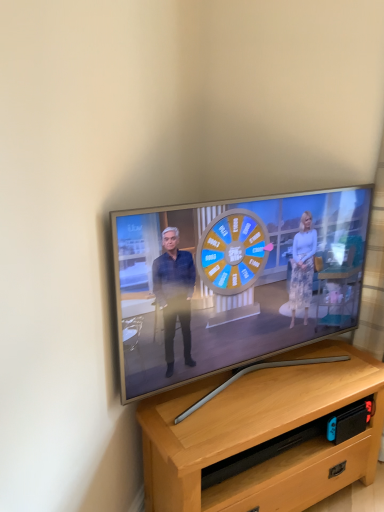
Find the location of `light brown wood desk at center`. light brown wood desk at center is located at coordinates click(261, 435).

Image resolution: width=384 pixels, height=512 pixels. What do you see at coordinates (261, 435) in the screenshot?
I see `light brown wood desk at center` at bounding box center [261, 435].

What do you see at coordinates (234, 282) in the screenshot?
I see `matte silver tv at center` at bounding box center [234, 282].

Find the location of a particular element. This screenshot has width=384, height=512. matte silver tv at center is located at coordinates (234, 282).

At what (x,y) coordinates should I click in order to perform the action: click on light brown wood desk at center. Please return your answer as a coordinate pair (x, y). Looking at the image, I should click on (261, 435).

Which object is positioned more to the left, matte silver tv at center or light brown wood desk at center?

matte silver tv at center is more to the left.

Is matte silver tv at center further to the viewer compared to light brown wood desk at center?

No, matte silver tv at center is closer to the camera.

Is point (323, 250) closer to camera compared to point (182, 422)?

No, (323, 250) is further to viewer.

Looking at this image, from the image's perspective, is matte silver tv at center under light brown wood desk at center?

No, from the image's perspective, matte silver tv at center is not below light brown wood desk at center.

From a real-world perspective, who is located lower, matte silver tv at center or light brown wood desk at center?

light brown wood desk at center.

Is matte silver tv at center wider than light brown wood desk at center?

No.

From their relative heights in the image, would you say matte silver tv at center is taller or shorter than light brown wood desk at center?

Considering their sizes, matte silver tv at center has more height than light brown wood desk at center.

Is matte silver tv at center smaller than light brown wood desk at center?

Yes.

Is light brown wood desk at center located within matte silver tv at center?

Definitely not — light brown wood desk at center is not inside matte silver tv at center.

Is matte silver tv at center positioned far away from light brown wood desk at center?

matte silver tv at center is actually quite close to light brown wood desk at center.

Could you tell me if matte silver tv at center is facing light brown wood desk at center?

Answer: No, matte silver tv at center is not facing towards light brown wood desk at center.

The width and height of the screenshot is (384, 512). I want to click on desk that is below the matte silver tv at center (from the image's perspective), so click(261, 435).

Can you confirm if light brown wood desk at center is positioned to the right of matte silver tv at center?

Correct, you'll find light brown wood desk at center to the right of matte silver tv at center.

In the scene shown: Which object is more forward, light brown wood desk at center or matte silver tv at center?

matte silver tv at center is closer to the camera.

Is point (292, 382) positioned after point (224, 219)?

That is True.

From the image's perspective, which is below, light brown wood desk at center or matte silver tv at center?

From the image's view, light brown wood desk at center is below.

From a real-world perspective, which object stands above the other?

From a 3D spatial view, matte silver tv at center is above.

Can you confirm if light brown wood desk at center is wider than matte silver tv at center?

Indeed, light brown wood desk at center has a greater width compared to matte silver tv at center.

Looking at this image, can you confirm if light brown wood desk at center is taller than matte silver tv at center?

No, light brown wood desk at center is not taller than matte silver tv at center.

Is light brown wood desk at center bigger or smaller than matte silver tv at center?

light brown wood desk at center is bigger than matte silver tv at center.

From the picture: Is light brown wood desk at center not within matte silver tv at center?

Absolutely, light brown wood desk at center is external to matte silver tv at center.

Consider the image. Are light brown wood desk at center and matte silver tv at center beside each other?

light brown wood desk at center and matte silver tv at center are clearly separated.

Is matte silver tv at center at the back of light brown wood desk at center?

No, light brown wood desk at center is not facing away from matte silver tv at center.

Where is `desk below the matte silver tv at center (from the image's perspective)`? desk below the matte silver tv at center (from the image's perspective) is located at coordinates (261, 435).

You are a GUI agent. You are given a task and a screenshot of the screen. Output one action in this format:
    pyautogui.click(x=<x>, y=<y>)
    Task: Click on the television in front of the light brown wood desk at center
    
    Given the screenshot: What is the action you would take?
    pyautogui.click(x=234, y=282)

Identify the location of television lying on the left of light brown wood desk at center. The image size is (384, 512). (234, 282).